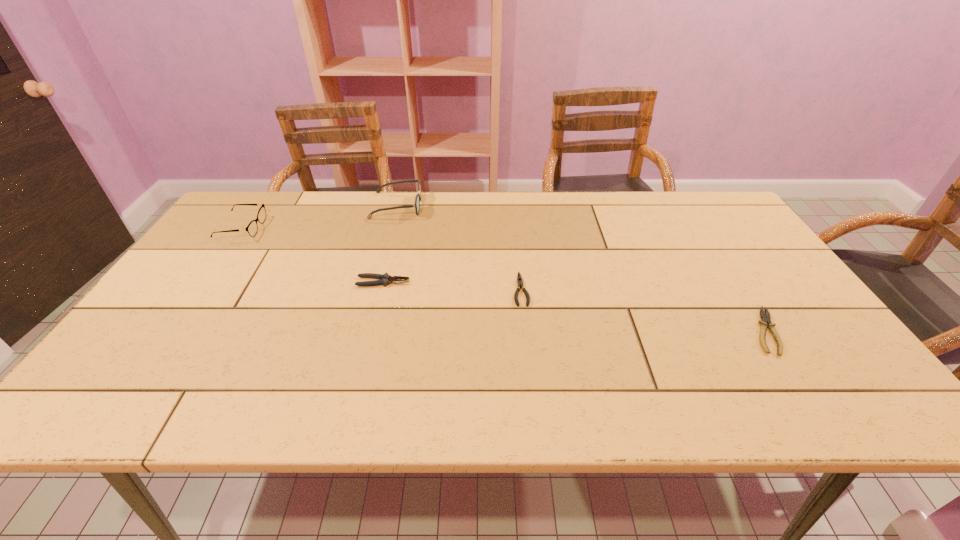
The image size is (960, 540). I want to click on the right spectacles, so click(x=418, y=197).

The height and width of the screenshot is (540, 960). I want to click on the taller spectacles, so [418, 197].

The height and width of the screenshot is (540, 960). What are the coordinates of `the shorter spectacles` in the screenshot? It's located at (252, 228).

In order to click on the fourth shortest object in this screenshot , I will do `click(252, 228)`.

Where is `the leftmost pliers`? Image resolution: width=960 pixels, height=540 pixels. the leftmost pliers is located at coordinates (385, 279).

Where is `the third shortest object`? the third shortest object is located at coordinates (385, 279).

You are a GUI agent. You are given a task and a screenshot of the screen. Output one action in this format:
    pyautogui.click(x=<x>, y=<y>)
    Task: Click on the second pliers from left to right
    This screenshot has height=540, width=960.
    Given the screenshot: What is the action you would take?
    [x=519, y=279]

I want to click on the rightmost object, so click(765, 316).

The image size is (960, 540). What are the coordinates of `the nearest object` in the screenshot? It's located at (765, 316).

Find the location of a particular element. This screenshot has height=540, width=960. free location located 0.240m on the face of the tallest object is located at coordinates (494, 206).